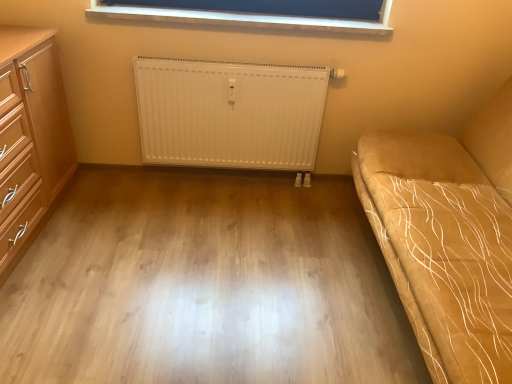
Question: Is white ribbed radiator at center aimed at light wood floor at center?

Choices:
 (A) yes
 (B) no

Answer: (A)

Question: Is white ribbed radiator at center touching light wood floor at center?

Choices:
 (A) no
 (B) yes

Answer: (A)

Question: Is white ribbed radiator at center outside of light wood floor at center?

Choices:
 (A) no
 (B) yes

Answer: (B)

Question: Is the depth of white ribbed radiator at center greater than that of light wood floor at center?

Choices:
 (A) no
 (B) yes

Answer: (B)

Question: Considering the relative positions of white ribbed radiator at center and light wood floor at center in the image provided, is white ribbed radiator at center in front of light wood floor at center?

Choices:
 (A) no
 (B) yes

Answer: (A)

Question: In terms of size, does light wood/wooden chest of drawers at left appear bigger or smaller than light wood floor at center?

Choices:
 (A) big
 (B) small

Answer: (A)

Question: Do you think light wood/wooden chest of drawers at left is within light wood floor at center, or outside of it?

Choices:
 (A) outside
 (B) inside

Answer: (A)

Question: Is point (29, 152) closer or farther from the camera than point (64, 322)?

Choices:
 (A) closer
 (B) farther

Answer: (B)

Question: Considering the positions of light wood/wooden chest of drawers at left and light wood floor at center in the image, is light wood/wooden chest of drawers at left taller or shorter than light wood floor at center?

Choices:
 (A) short
 (B) tall

Answer: (B)

Question: From the image's perspective, relative to light wood floor at center, is suede-like beige studio couch at right above or below?

Choices:
 (A) above
 (B) below

Answer: (A)

Question: Based on their positions, is suede-like beige studio couch at right located to the left or right of light wood floor at center?

Choices:
 (A) right
 (B) left

Answer: (A)

Question: From a real-world perspective, is suede-like beige studio couch at right physically located above or below light wood floor at center?

Choices:
 (A) below
 (B) above

Answer: (B)

Question: In terms of height, does suede-like beige studio couch at right look taller or shorter compared to light wood floor at center?

Choices:
 (A) short
 (B) tall

Answer: (B)

Question: Considering the positions of point (16, 180) and point (117, 18), is point (16, 180) closer or farther from the camera than point (117, 18)?

Choices:
 (A) closer
 (B) farther

Answer: (A)

Question: From the image's perspective, is light wood/wooden chest of drawers at left located above or below blue fabric at upper center?

Choices:
 (A) above
 (B) below

Answer: (B)